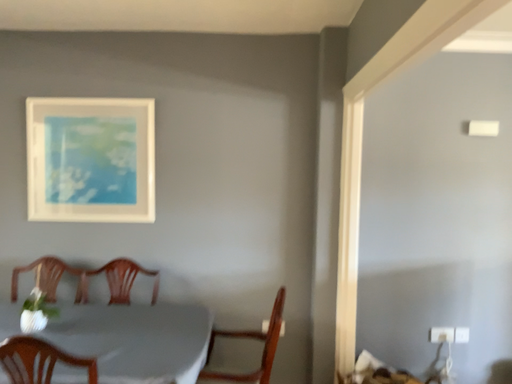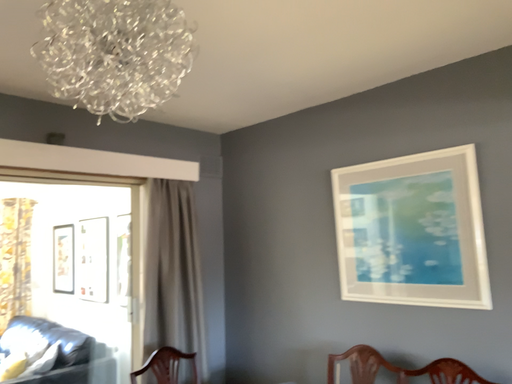
Question: Which way did the camera rotate in the video?

Choices:
 (A) rotated upward
 (B) rotated downward

Answer: (A)